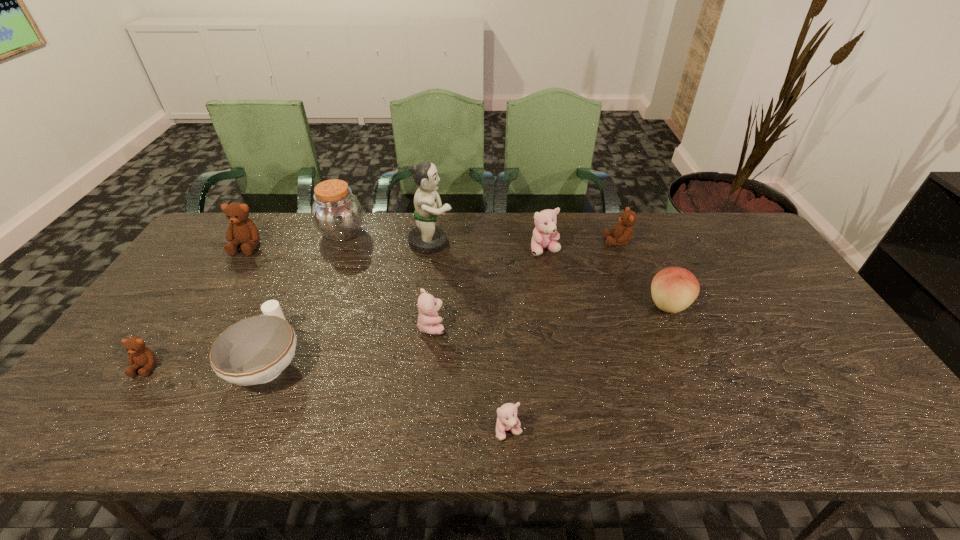
Locate an element on the screen. This screenshot has width=960, height=540. green figurine is located at coordinates (425, 238).

At what (x,y) coordinates should I click in order to perform the action: click on the tallest object. Please return your answer as a coordinate pair (x, y). Looking at the image, I should click on (425, 238).

Locate an element on the screen. The image size is (960, 540). jar is located at coordinates (337, 214).

Image resolution: width=960 pixels, height=540 pixels. Identify the location of the eighth object from left to right. (545, 236).

Locate an element on the screen. Image resolution: width=960 pixels, height=540 pixels. the second teddy bear from right to left is located at coordinates (545, 236).

The width and height of the screenshot is (960, 540). Identify the location of the biggest brown teddy bear. (242, 230).

You are a GUI agent. You are given a task and a screenshot of the screen. Output one action in this format:
    pyautogui.click(x=<x>, y=<y>)
    Task: Click on the second biggest brown teddy bear
    This screenshot has width=960, height=540.
    Given the screenshot: What is the action you would take?
    pyautogui.click(x=623, y=232)

Identify the location of the rightmost brown teddy bear. (623, 232).

I want to click on the second biggest pink teddy bear, so click(x=428, y=320).

Find the location of a particular element. the second nearest pink teddy bear is located at coordinates (428, 320).